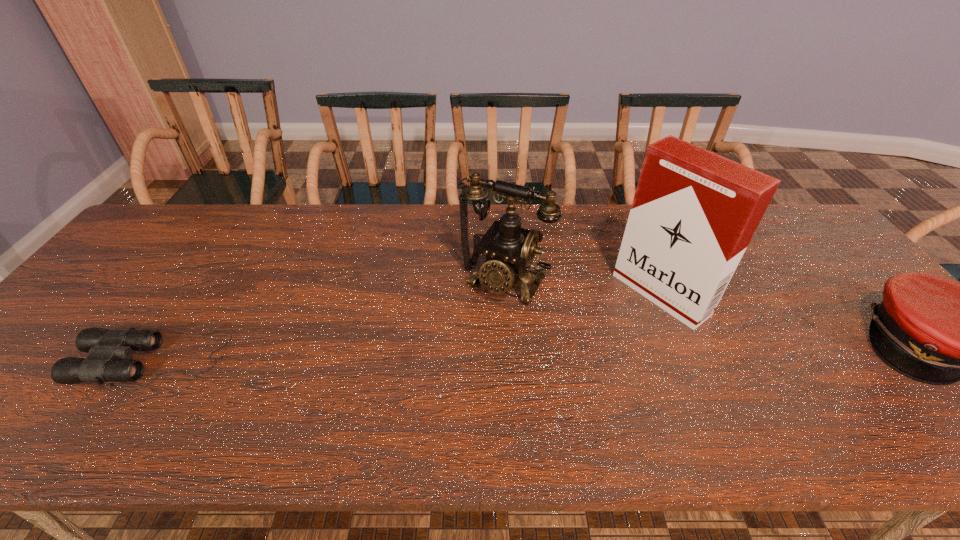
Locate an element on the screen. the shortest object is located at coordinates (106, 347).

I want to click on the leftmost object, so click(106, 347).

At what (x,y) coordinates should I click in order to perform the action: click on the tallest object. Please return your answer as a coordinate pair (x, y). This screenshot has width=960, height=540. Looking at the image, I should click on (694, 212).

The width and height of the screenshot is (960, 540). Identify the location of cigarette_case. coord(694,212).

Locate an element on the screen. This screenshot has height=540, width=960. the second object from left to right is located at coordinates (509, 249).

Image resolution: width=960 pixels, height=540 pixels. In order to click on telephone in this screenshot , I will do `click(509, 249)`.

I want to click on vacant area located 0.090m at the eyepiece of the leftmost object, so click(x=46, y=360).

This screenshot has height=540, width=960. Identify the location of free space located 0.100m at the eyepiece of the leftmost object. (42, 360).

You are a GUI agent. You are given a task and a screenshot of the screen. Output one action in this format:
    pyautogui.click(x=<x>, y=<y>)
    Task: Click on the vacant space located at the eyepiece of the leftmost object
    
    Given the screenshot: What is the action you would take?
    pyautogui.click(x=34, y=360)

This screenshot has width=960, height=540. I want to click on vacant area situated on the front-facing side of the second object from right to left, so click(607, 336).